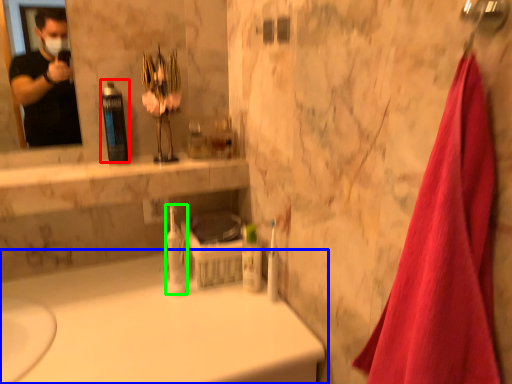
Question: Which is nearer to the mouthwash (highlighted by a red box)? bathtub (highlighted by a blue box) or mouthwash (highlighted by a green box).

Choices:
 (A) bathtub
 (B) mouthwash

Answer: (B)